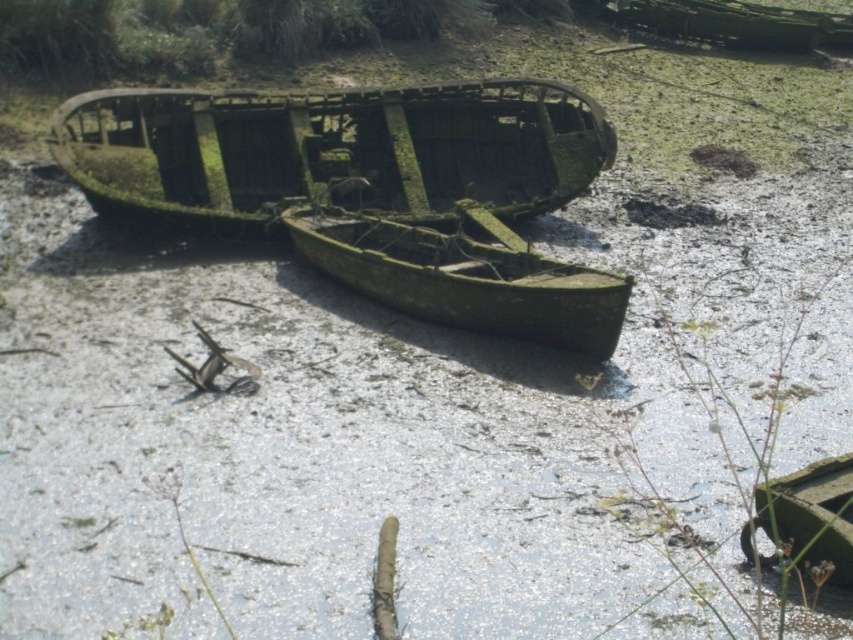
Question: Which point appears closest to the camera in this image?

Choices:
 (A) (230, 164)
 (B) (563, 307)

Answer: (B)

Question: Is green mossy wood boat at center above green mossy wood canoe at center?

Choices:
 (A) yes
 (B) no

Answer: (A)

Question: Does green mossy wood boat at center appear under green mossy wood canoe at center?

Choices:
 (A) no
 (B) yes

Answer: (A)

Question: Which point is farther to the camera?

Choices:
 (A) green mossy wood canoe at center
 (B) green mossy wood boat at center

Answer: (B)

Question: Can you confirm if green mossy wood boat at center is positioned to the left of green mossy wood canoe at center?

Choices:
 (A) yes
 (B) no

Answer: (A)